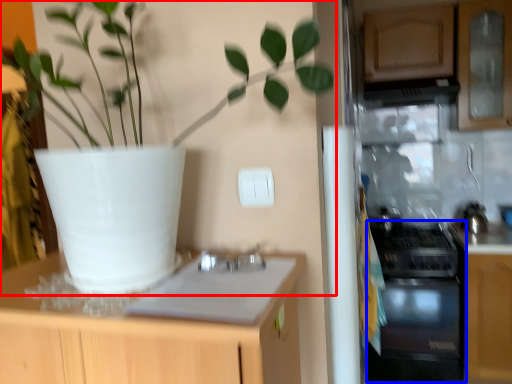
Question: Which point is further to the camera, houseplant (highlighted by a red box) or oven (highlighted by a blue box)?

Choices:
 (A) houseplant
 (B) oven

Answer: (B)